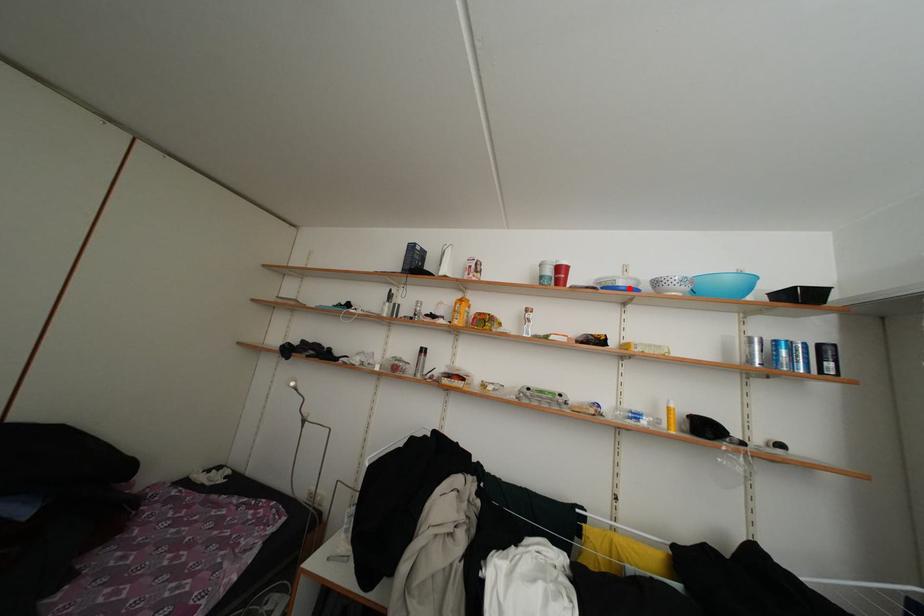
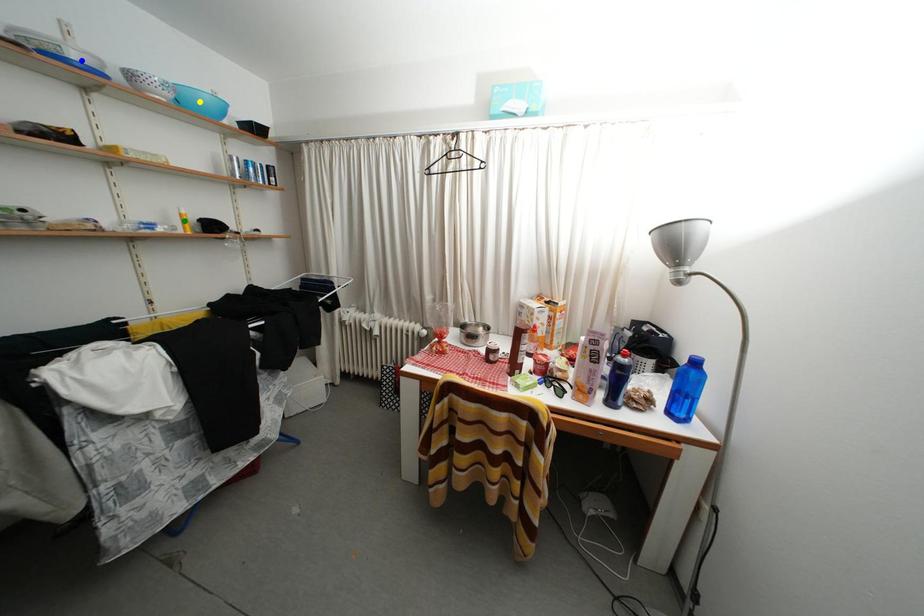
Question: I am providing you with two images of the same scene from different viewpoints. A red point is marked on the first image. You are given multiple points on the second image. Can you choose the point in image 2 that corresponds to the point in image 1?

Choices:
 (A) green point
 (B) blue point
 (C) yellow point

Answer: (B)